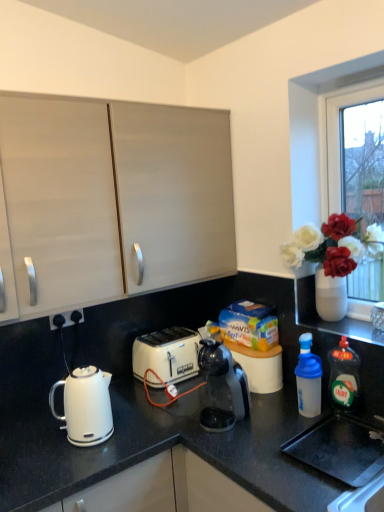
Question: In terms of width, does black plastic electrical outlet at lower left look wider or thinner when compared to transparent plastic bottle at right, the second bottle positioned from the right?

Choices:
 (A) thin
 (B) wide

Answer: (A)

Question: From a real-world perspective, is black plastic electrical outlet at lower left physically located above or below transparent plastic bottle at right, the second bottle positioned from the right?

Choices:
 (A) above
 (B) below

Answer: (A)

Question: Which is farther from the white plastic toaster at center?

Choices:
 (A) black plastic electrical outlet at lower left
 (B) green translucent bottle at right, acting as the 1th bottle starting from the right
 (C) matte white cabinet at upper left
 (D) white glossy kettle at left
 (E) transparent plastic coffee maker at center

Answer: (B)

Question: Which is farther from the green translucent bottle at right, acting as the 2th bottle starting from the left?

Choices:
 (A) matte white cabinet at upper left
 (B) black plastic electrical outlet at lower left
 (C) white glossy electric kettle at lower left
 (D) transparent plastic coffee maker at center
 (E) white plastic toaster at center

Answer: (B)